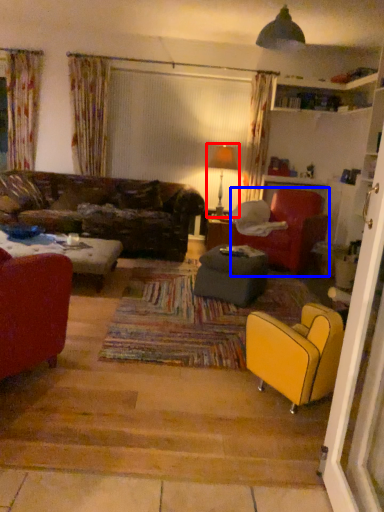
Question: Which point is further to the camera, lamp (highlighted by a red box) or chair (highlighted by a blue box)?

Choices:
 (A) lamp
 (B) chair

Answer: (A)